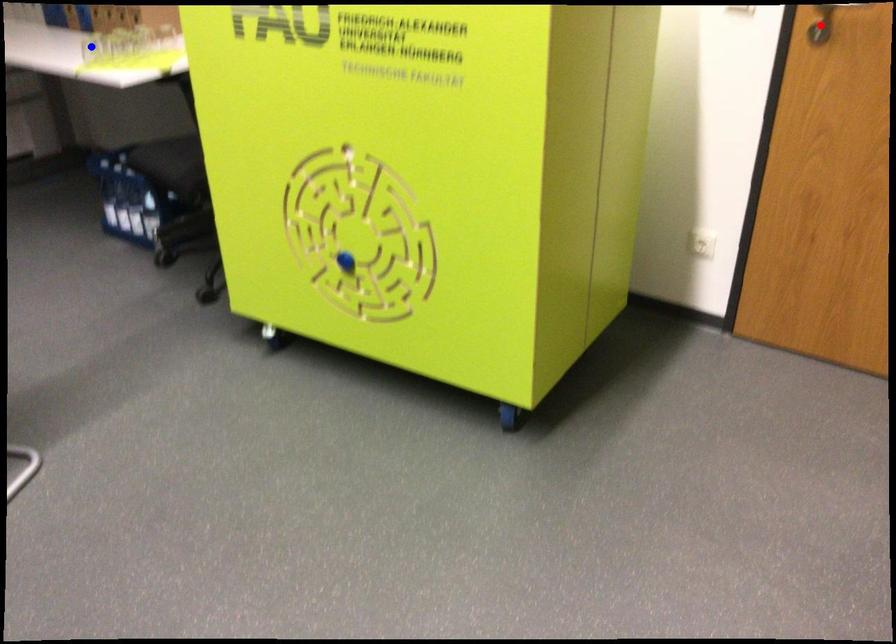
Question: In the image, two points are highlighted. Which point is nearer to the camera? Reply with the corresponding letter.

Choices:
 (A) blue point
 (B) red point

Answer: (B)